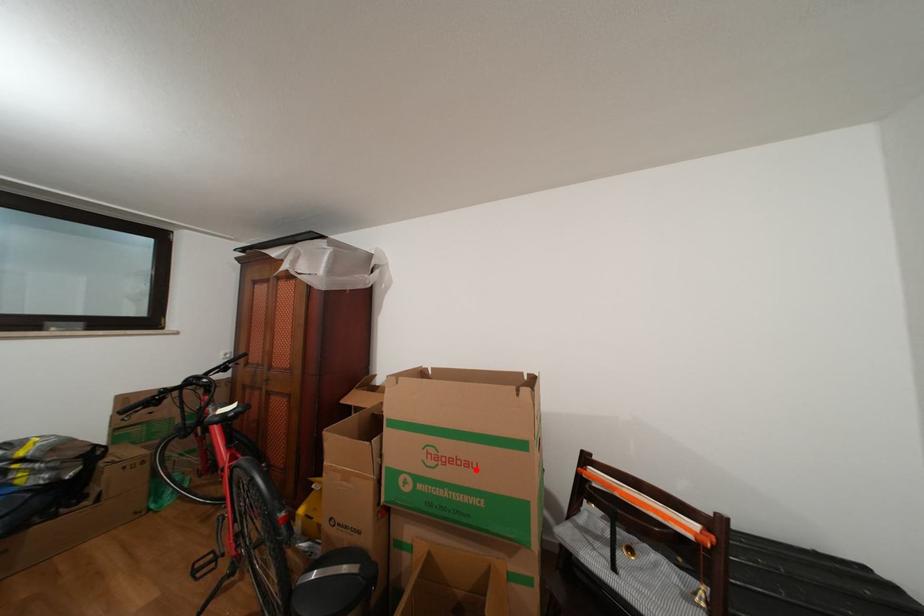
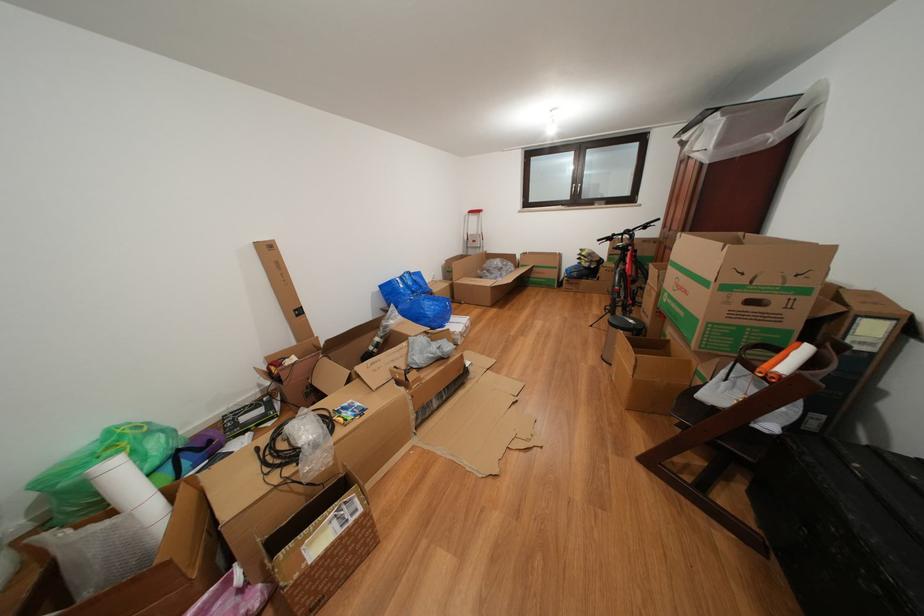
Where in the second image is the point corresponding to the highlighted location from the first image?

(694, 297)